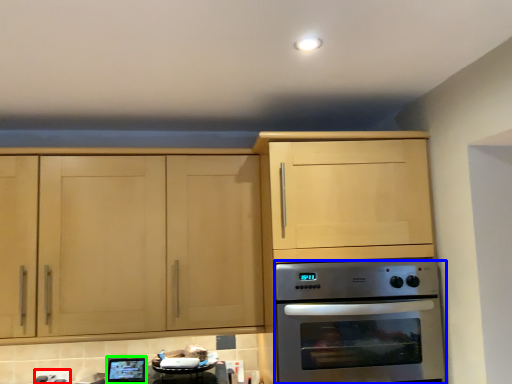
Question: Which object is the closest to the electric outlet (highlighted by a red box)? Choose among these: oven (highlighted by a blue box) or appliance (highlighted by a green box).

Choices:
 (A) oven
 (B) appliance

Answer: (B)